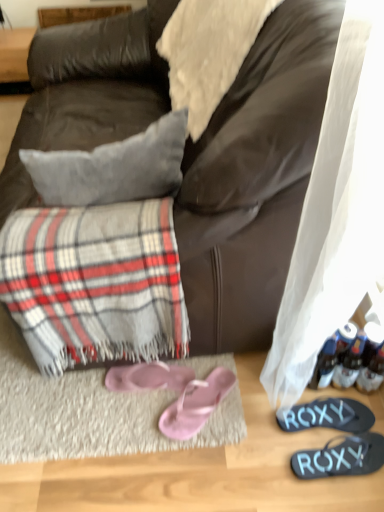
You are a GUI agent. You are given a task and a screenshot of the screen. Output one action in this format:
    pyautogui.click(x=<x>, y=<y>)
    Task: Click on the vacant space situated above pink satin flip-flops at lower center, which is the 3th footwear in right-to-left order (from a real-world perspective)
    
    Given the screenshot: What is the action you would take?
    pyautogui.click(x=195, y=399)